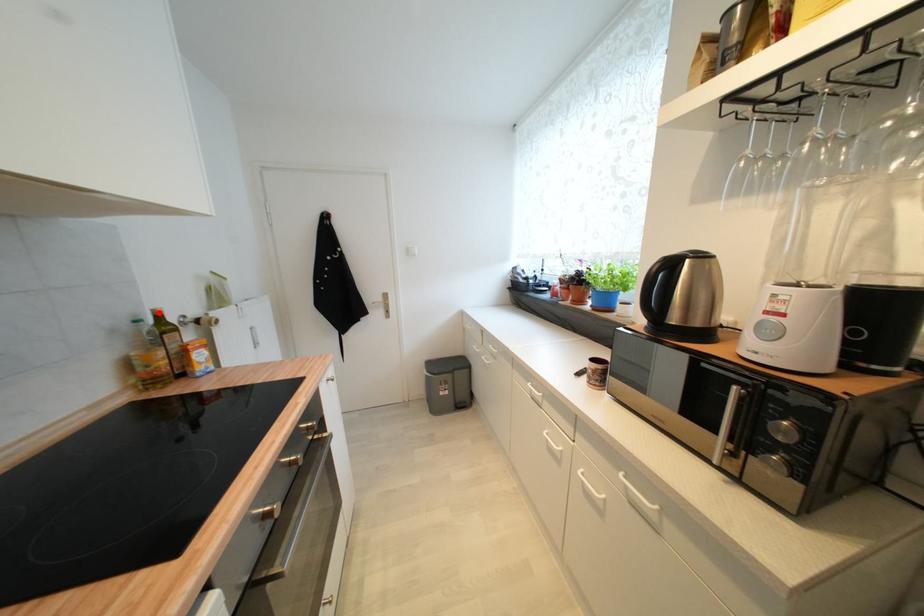
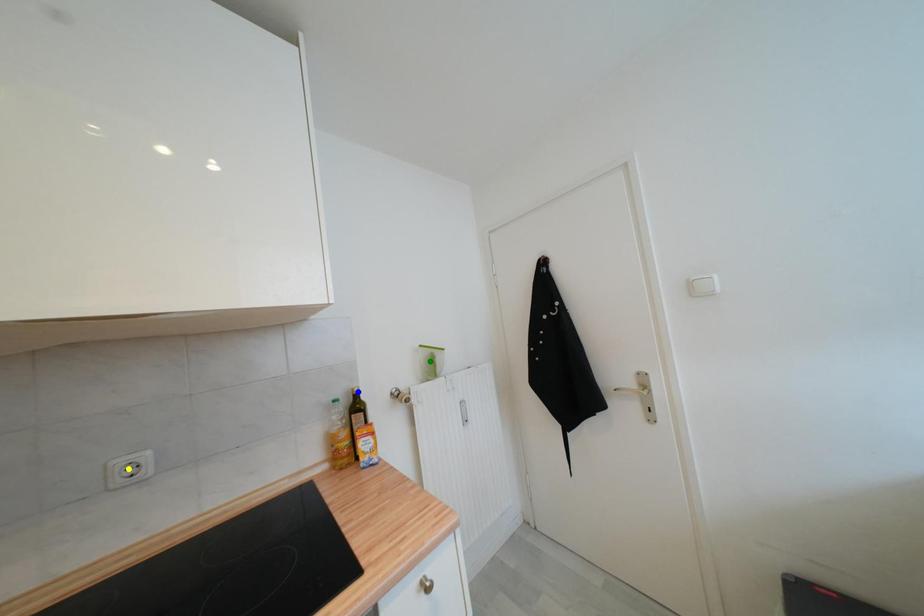
Question: I am providing you with two images of the same scene from different viewpoints. A red point is marked on the first image. You are given multiple points on the second image. Can you choose the point in image 2 that corresponds to the point in image 1?

Choices:
 (A) green point
 (B) blue point
 (C) yellow point

Answer: (B)